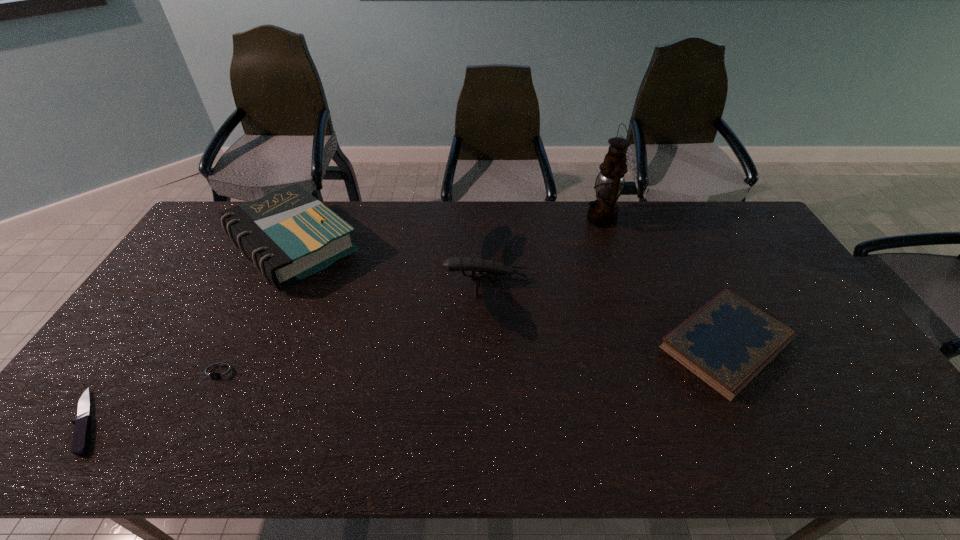
The width and height of the screenshot is (960, 540). Find the location of `drone that is positioned at the far edge`. drone that is positioned at the far edge is located at coordinates (500, 309).

Identify the location of object situated at the near edge. (82, 430).

At what (x,y) coordinates should I click in order to perform the action: click on paperback book that is at the left edge. Please return your answer as a coordinate pair (x, y). Looking at the image, I should click on tap(289, 234).

I want to click on steak knife that is at the left edge, so click(x=82, y=430).

Image resolution: width=960 pixels, height=540 pixels. I want to click on object that is at the right edge, so click(726, 343).

Find the location of a particular element. Image resolution: width=960 pixels, height=540 pixels. object located at the far left corner is located at coordinates (289, 234).

Image resolution: width=960 pixels, height=540 pixels. I want to click on object that is at the near left corner, so click(x=82, y=430).

Identify the location of free region at the far edge. (358, 202).

In order to click on vacant space at the near edge of the desktop in this screenshot , I will do [x=310, y=440].

Identify the location of free space at the left edge. (73, 406).